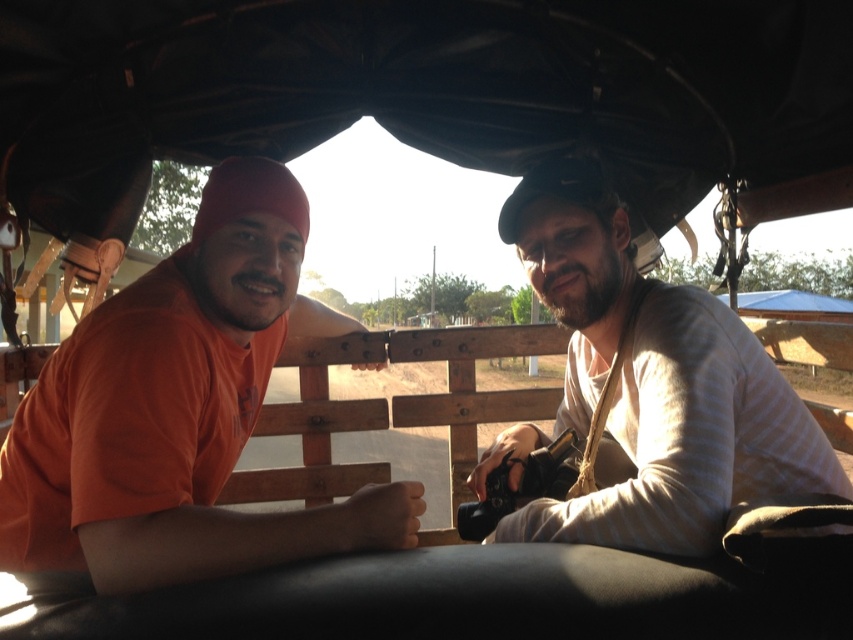
Does orange cotton shirt at left appear on the left side of beige striped shirt at right?

Indeed, orange cotton shirt at left is positioned on the left side of beige striped shirt at right.

Between orange cotton shirt at left and beige striped shirt at right, which one is positioned higher?

Positioned higher is orange cotton shirt at left.

The image size is (853, 640). What do you see at coordinates (181, 412) in the screenshot?
I see `orange cotton shirt at left` at bounding box center [181, 412].

You are a GUI agent. You are given a task and a screenshot of the screen. Output one action in this format:
    pyautogui.click(x=<x>, y=<y>)
    Task: Click on the orange cotton shirt at left
    The image size is (853, 640).
    Given the screenshot: What is the action you would take?
    pyautogui.click(x=181, y=412)